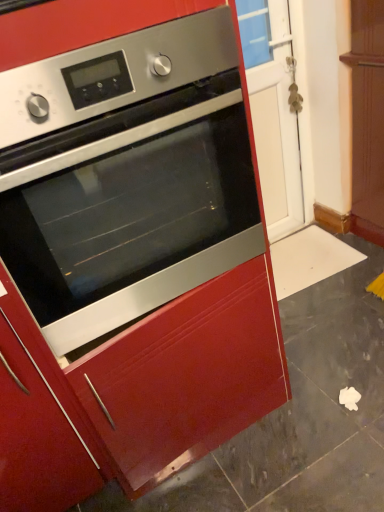
Question: Does glossy wood drawer at center lie in front of stainless steel oven at center?

Choices:
 (A) yes
 (B) no

Answer: (B)

Question: Considering the relative positions of glossy wood drawer at center and stainless steel oven at center in the image provided, is glossy wood drawer at center to the left of stainless steel oven at center from the viewer's perspective?

Choices:
 (A) yes
 (B) no

Answer: (B)

Question: Could you tell me if glossy wood drawer at center is turned towards stainless steel oven at center?

Choices:
 (A) no
 (B) yes

Answer: (A)

Question: Considering the relative sizes of glossy wood drawer at center and stainless steel oven at center in the image provided, is glossy wood drawer at center taller than stainless steel oven at center?

Choices:
 (A) no
 (B) yes

Answer: (A)

Question: Could stainless steel oven at center be considered to be inside glossy wood drawer at center?

Choices:
 (A) yes
 (B) no

Answer: (B)

Question: Is point pyautogui.click(x=292, y=159) positioned closer to the camera than point pyautogui.click(x=213, y=218)?

Choices:
 (A) closer
 (B) farther

Answer: (B)

Question: Looking at the image, does transparent glass door at center seem bigger or smaller compared to stainless steel oven at center?

Choices:
 (A) small
 (B) big

Answer: (A)

Question: Is transparent glass door at center situated inside stainless steel oven at center or outside?

Choices:
 (A) inside
 (B) outside

Answer: (B)

Question: From a real-world perspective, relative to stainless steel oven at center, is transparent glass door at center vertically above or below?

Choices:
 (A) above
 (B) below

Answer: (B)

Question: Considering the positions of transparent glass door at center and glossy wood drawer at center in the image, is transparent glass door at center taller or shorter than glossy wood drawer at center?

Choices:
 (A) tall
 (B) short

Answer: (A)

Question: Would you say transparent glass door at center is to the left or to the right of glossy wood drawer at center in the picture?

Choices:
 (A) left
 (B) right

Answer: (B)

Question: Is transparent glass door at center spatially inside glossy wood drawer at center, or outside of it?

Choices:
 (A) inside
 (B) outside

Answer: (B)

Question: Does point (261, 166) appear closer or farther from the camera than point (89, 374)?

Choices:
 (A) farther
 (B) closer

Answer: (A)

Question: Is glossy wood drawer at center taller or shorter than transparent glass door at center?

Choices:
 (A) short
 (B) tall

Answer: (A)

Question: Is point (274, 329) positioned closer to the camera than point (258, 97)?

Choices:
 (A) closer
 (B) farther

Answer: (A)